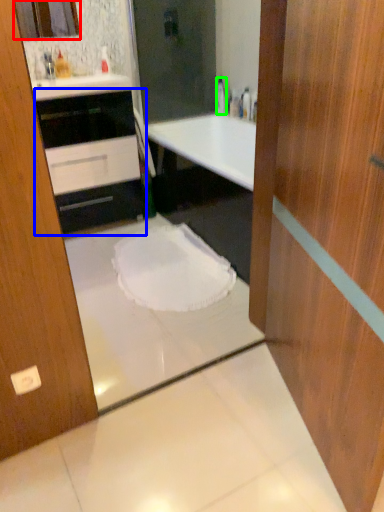
Question: Considering the real-world distances, which object is farthest from mirror (highlighted by a red box)? cabinetry (highlighted by a blue box) or bottle (highlighted by a green box)?

Choices:
 (A) cabinetry
 (B) bottle

Answer: (B)